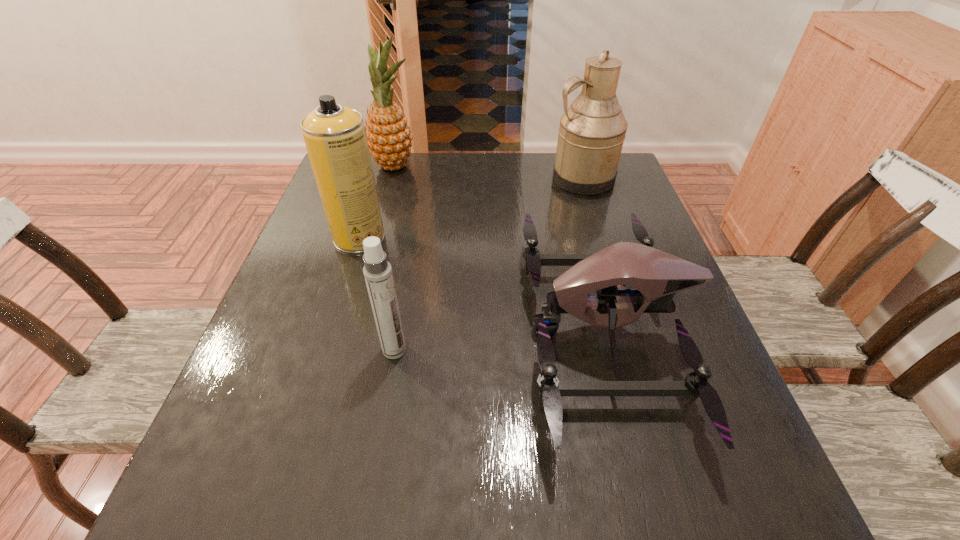
I want to click on free space located 0.170m on the back of the shorter aerosol can, so click(407, 279).

Identify the location of blank space located 0.220m on the front-facing side of the shortest object. This screenshot has height=540, width=960. (414, 332).

Identify the location of vacant region located 0.180m on the front-facing side of the shortest object. (434, 332).

At what (x,y) coordinates should I click in order to perform the action: click on vacant space situated 0.360m on the front-facing side of the shortest object. Please return your answer as a coordinate pair (x, y). Looking at the image, I should click on (342, 332).

This screenshot has height=540, width=960. Identify the location of pineapple that is at the far edge. (388, 135).

Locate an element on the screen. pitcher present at the far edge is located at coordinates pyautogui.click(x=592, y=130).

This screenshot has width=960, height=540. Identify the location of object that is at the near edge. (656, 276).

This screenshot has width=960, height=540. Identify the location of pineapple that is at the left edge. point(388,135).

Identify the location of aerosol can at the left edge. This screenshot has width=960, height=540. (335, 137).

At what (x,y) coordinates should I click in order to perform the action: click on pitcher located at the right edge. Please return your answer as a coordinate pair (x, y). Looking at the image, I should click on (592, 130).